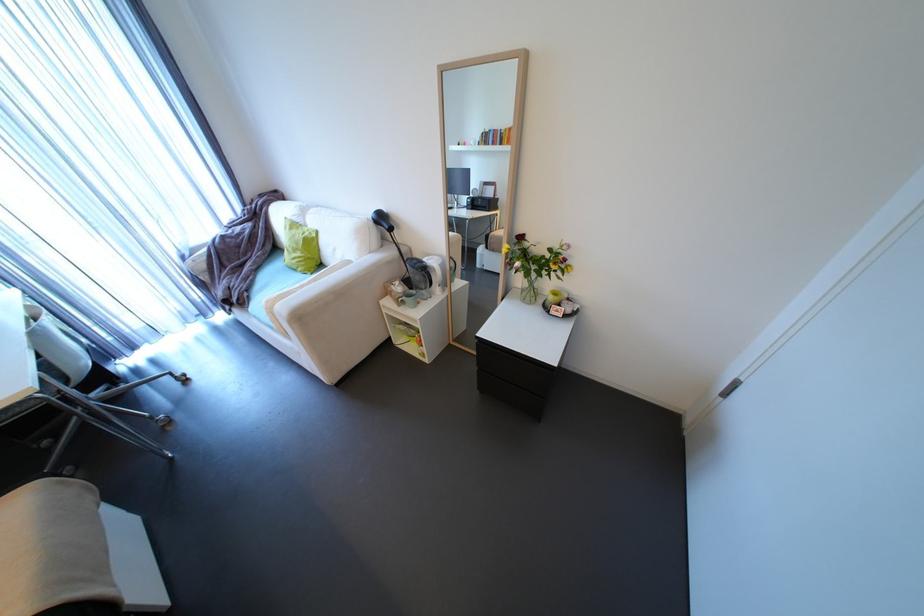
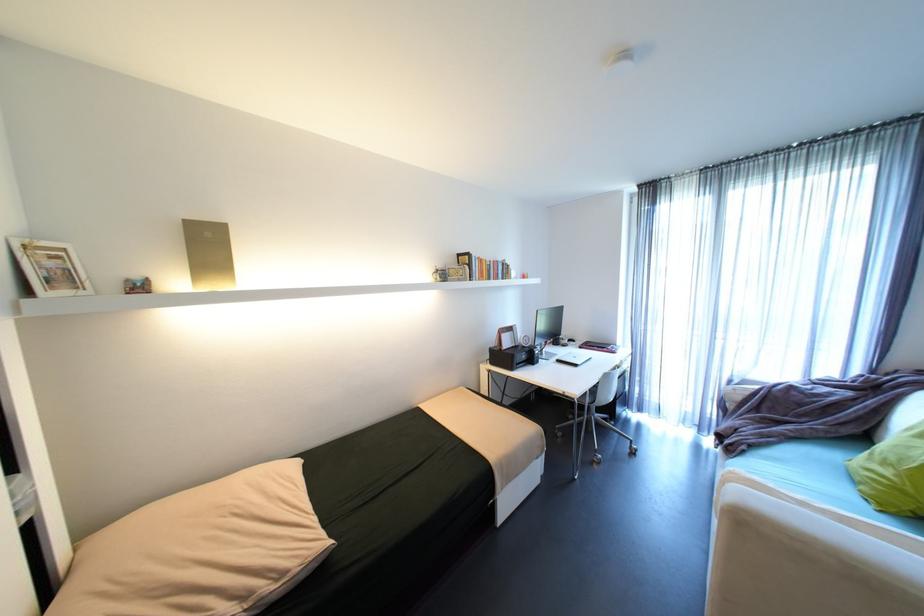
Where in the second image is the point corresponding to (256,297) from the first image?

(751, 451)